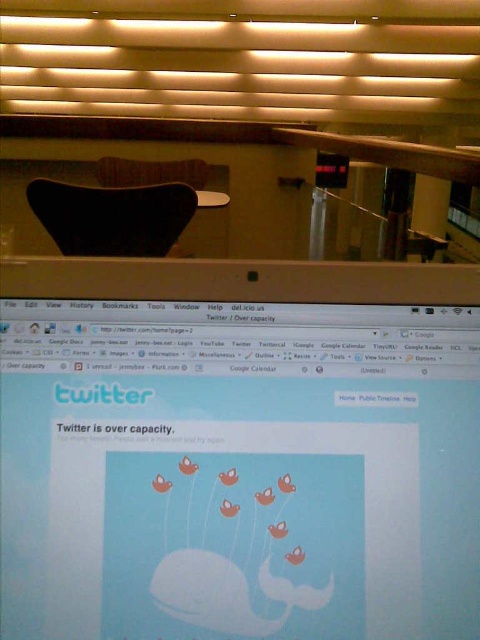
Question: Which of the following is the closest to the observer?

Choices:
 (A) (423, 566)
 (B) (160, 205)

Answer: (A)

Question: Is satin silver laptop at center wider than black matte chair at upper center?

Choices:
 (A) no
 (B) yes

Answer: (A)

Question: Can you confirm if satin silver laptop at center is positioned to the right of black matte chair at upper center?

Choices:
 (A) yes
 (B) no

Answer: (A)

Question: In this image, where is satin silver laptop at center located relative to black matte chair at upper center?

Choices:
 (A) right
 (B) left

Answer: (A)

Question: Which object is farther from the camera taking this photo?

Choices:
 (A) satin silver laptop at center
 (B) black matte chair at upper center

Answer: (B)

Question: Which of the following is the farthest from the observer?

Choices:
 (A) black matte chair at upper center
 (B) satin silver laptop at center

Answer: (A)